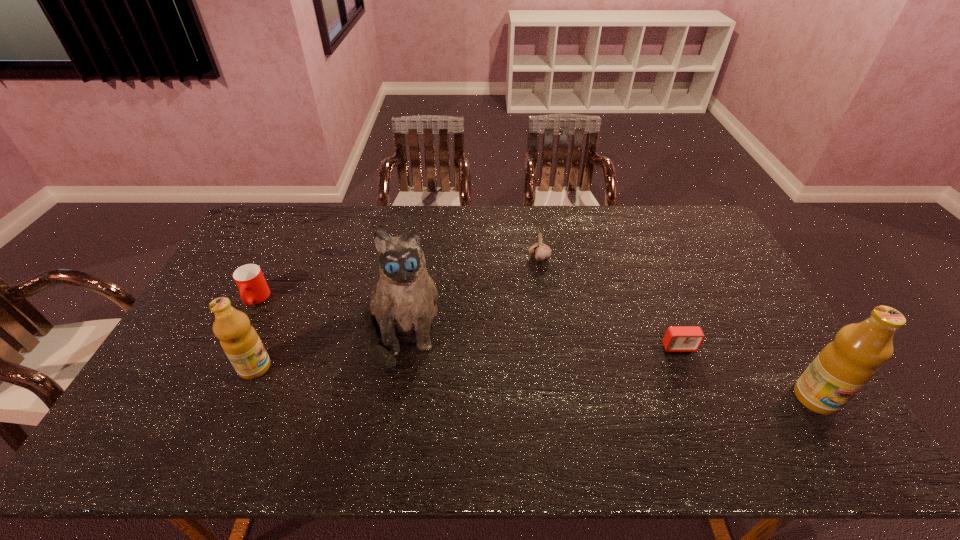
The height and width of the screenshot is (540, 960). I want to click on vacant position located 0.250m on the label of the left olive oil, so click(x=364, y=368).

What are the coordinates of `free spot located 0.110m on the front of the garlic` in the screenshot? It's located at (544, 288).

Find the location of a particular element. The height and width of the screenshot is (540, 960). blank space located 0.120m on the front-facing side of the alarm clock is located at coordinates (697, 390).

What are the coordinates of `blank space located 0.110m at the face of the third object from left to right` in the screenshot? It's located at (387, 414).

The height and width of the screenshot is (540, 960). I want to click on free spot located on the side of the leftmost object with the handle, so click(230, 349).

Locate an element on the screen. object that is positioned at the near edge is located at coordinates (x=844, y=366).

Where is `object that is at the left edge`? The height and width of the screenshot is (540, 960). object that is at the left edge is located at coordinates (253, 288).

Locate an element on the screen. The width and height of the screenshot is (960, 540). object present at the right edge is located at coordinates (844, 366).

You are a GUI agent. You are given a task and a screenshot of the screen. Output one action in this format:
    pyautogui.click(x=<x>, y=<y>)
    Task: Click on the object present at the near right corner
    
    Given the screenshot: What is the action you would take?
    pyautogui.click(x=844, y=366)

Image resolution: width=960 pixels, height=540 pixels. Find the location of `free space at the far edge`. free space at the far edge is located at coordinates (358, 211).